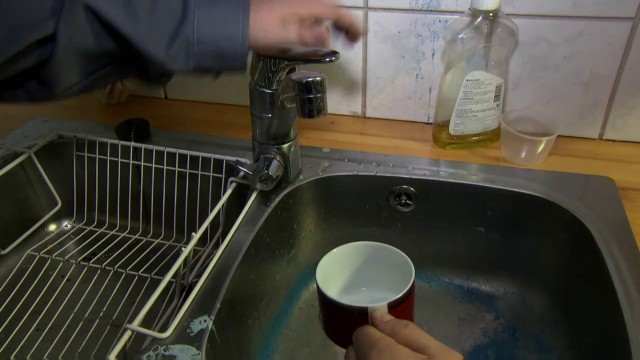
The height and width of the screenshot is (360, 640). Find the location of `sink`. sink is located at coordinates (484, 314).